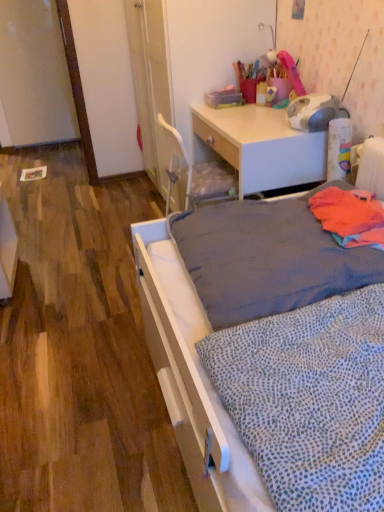
Question: Could you tell me if white dotted fabric at lower right, the 1th blanket from the bottom, is turned towards orange fabric at right, which is counted as the first blanket, starting from the top?

Choices:
 (A) yes
 (B) no

Answer: (B)

Question: From a real-world perspective, is white dotted fabric at lower right, which appears as the first blanket when viewed from the front, physically below orange fabric at right, marked as the first blanket in a back-to-front arrangement?

Choices:
 (A) no
 (B) yes

Answer: (B)

Question: Can you confirm if white dotted fabric at lower right, the 1th blanket from the bottom, is thinner than orange fabric at right, marked as the first blanket in a back-to-front arrangement?

Choices:
 (A) no
 (B) yes

Answer: (A)

Question: Can you confirm if white dotted fabric at lower right, the 1th blanket from the bottom, is shorter than orange fabric at right, arranged as the 2th blanket when ordered from the bottom?

Choices:
 (A) yes
 (B) no

Answer: (B)

Question: Is white dotted fabric at lower right, the 2th blanket positioned from the top, in contact with orange fabric at right, arranged as the 2th blanket when ordered from the bottom?

Choices:
 (A) yes
 (B) no

Answer: (B)

Question: In terms of width, does orange fabric at right, marked as the first blanket in a back-to-front arrangement, look wider or thinner when compared to gray fabric mattress at center?

Choices:
 (A) wide
 (B) thin

Answer: (B)

Question: Visually, is orange fabric at right, the second blanket from the front, positioned to the left or to the right of gray fabric mattress at center?

Choices:
 (A) right
 (B) left

Answer: (A)

Question: From a real-world perspective, relative to gray fabric mattress at center, is orange fabric at right, arranged as the 2th blanket when ordered from the bottom, vertically above or below?

Choices:
 (A) above
 (B) below

Answer: (A)

Question: Is orange fabric at right, the second blanket from the front, bigger or smaller than gray fabric mattress at center?

Choices:
 (A) big
 (B) small

Answer: (B)

Question: From their relative heights in the image, would you say gray fabric mattress at center is taller or shorter than white dotted fabric at lower right, the 2th blanket viewed from the back?

Choices:
 (A) short
 (B) tall

Answer: (B)

Question: Is point (319, 184) positioned closer to the camera than point (218, 362)?

Choices:
 (A) farther
 (B) closer

Answer: (A)

Question: From the image's perspective, is gray fabric mattress at center located above or below white dotted fabric at lower right, the 2th blanket positioned from the top?

Choices:
 (A) below
 (B) above

Answer: (B)

Question: From a real-world perspective, is gray fabric mattress at center physically located above or below white dotted fabric at lower right, the 2th blanket viewed from the back?

Choices:
 (A) below
 (B) above

Answer: (B)

Question: Considering the relative positions of orange fabric at right, arranged as the 2th blanket when ordered from the bottom, and white dotted fabric at lower right, the 2th blanket positioned from the top, in the image provided, is orange fabric at right, arranged as the 2th blanket when ordered from the bottom, to the left or to the right of white dotted fabric at lower right, the 2th blanket positioned from the top,?

Choices:
 (A) right
 (B) left

Answer: (A)

Question: Considering the positions of orange fabric at right, arranged as the 2th blanket when ordered from the bottom, and white dotted fabric at lower right, the 2th blanket positioned from the top, in the image, is orange fabric at right, arranged as the 2th blanket when ordered from the bottom, taller or shorter than white dotted fabric at lower right, the 2th blanket positioned from the top,?

Choices:
 (A) short
 (B) tall

Answer: (A)